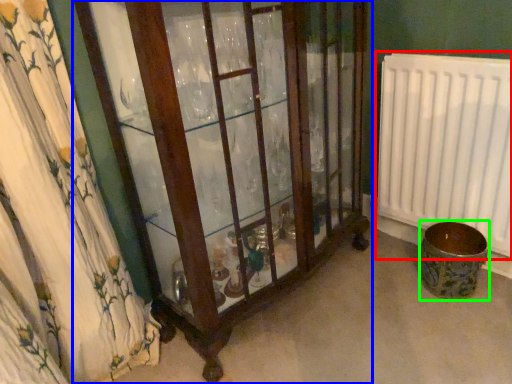
Question: Considering the real-world distances, which object is closest to radiator (highlighted by a red box)? furniture (highlighted by a blue box) or toilet bowl (highlighted by a green box).

Choices:
 (A) furniture
 (B) toilet bowl

Answer: (B)